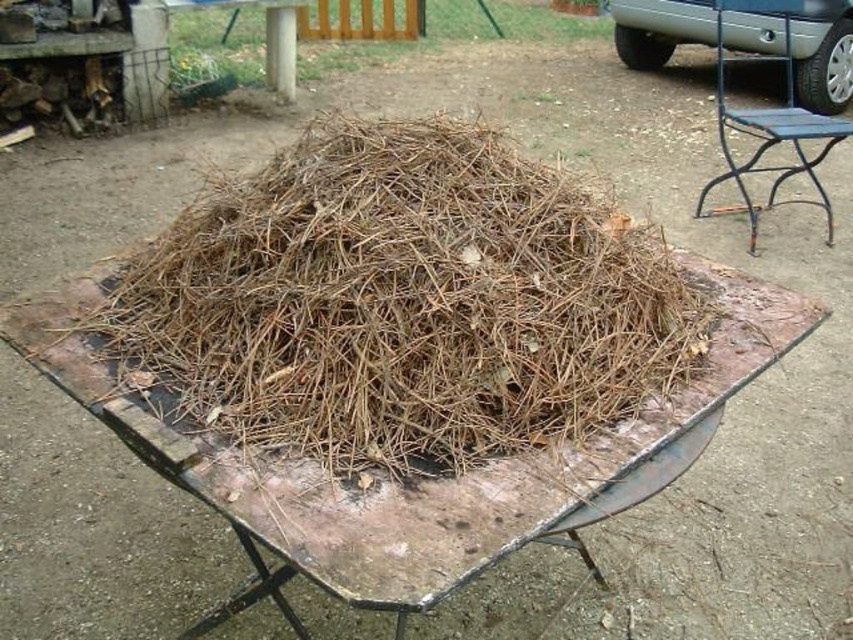
Is point (288, 189) positioned in front of point (733, 118)?

Yes, it is in front of point (733, 118).

Is brown dry hay at center in front of black metal chair at right?

That is True.

Does point (599, 300) come behind point (827, 124)?

No, (599, 300) is in front of (827, 124).

Find the location of a particular element. brown dry hay at center is located at coordinates (404, 301).